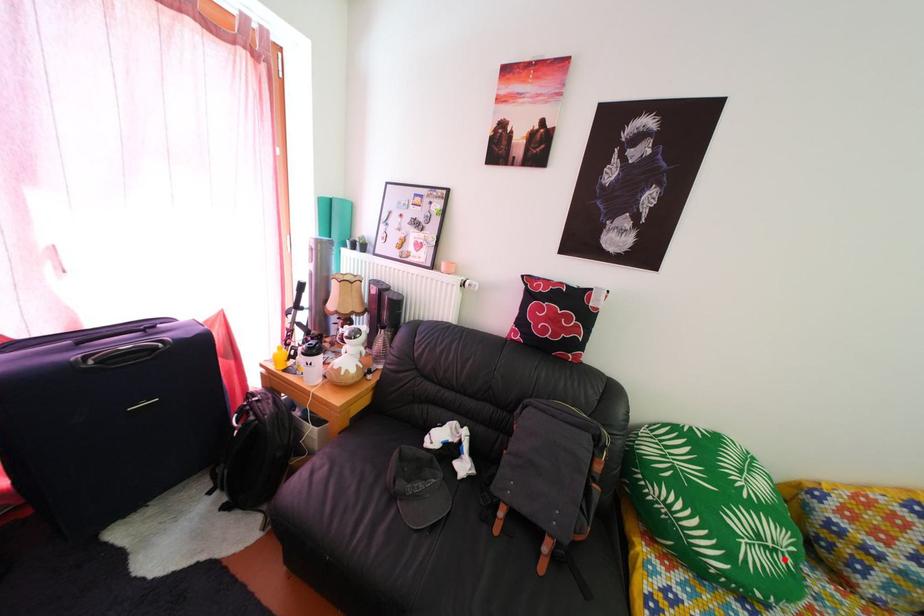
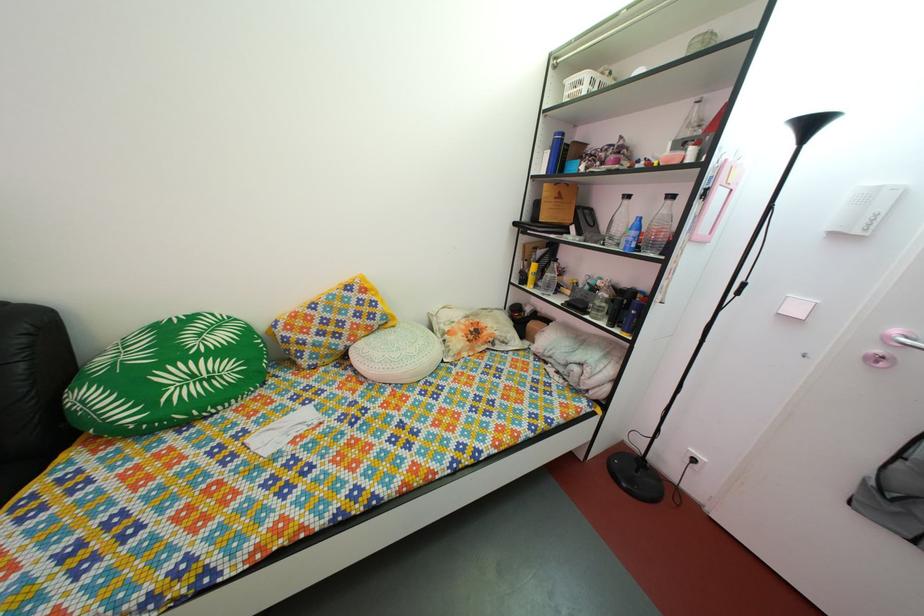
Locate, in the second image, the point that corresponds to the highlighted location in the first image.

(220, 387)